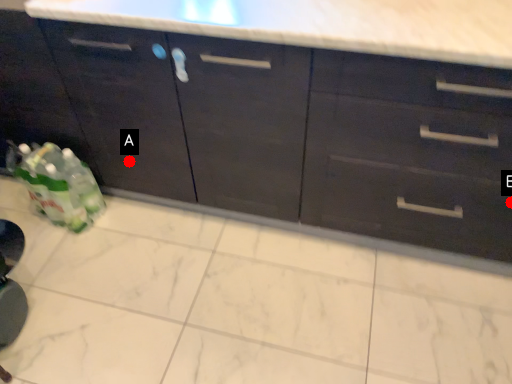
Question: Two points are circled on the image, labeled by A and B beside each circle. Which of the following is the closest to the observer?

Choices:
 (A) A is closer
 (B) B is closer

Answer: (B)